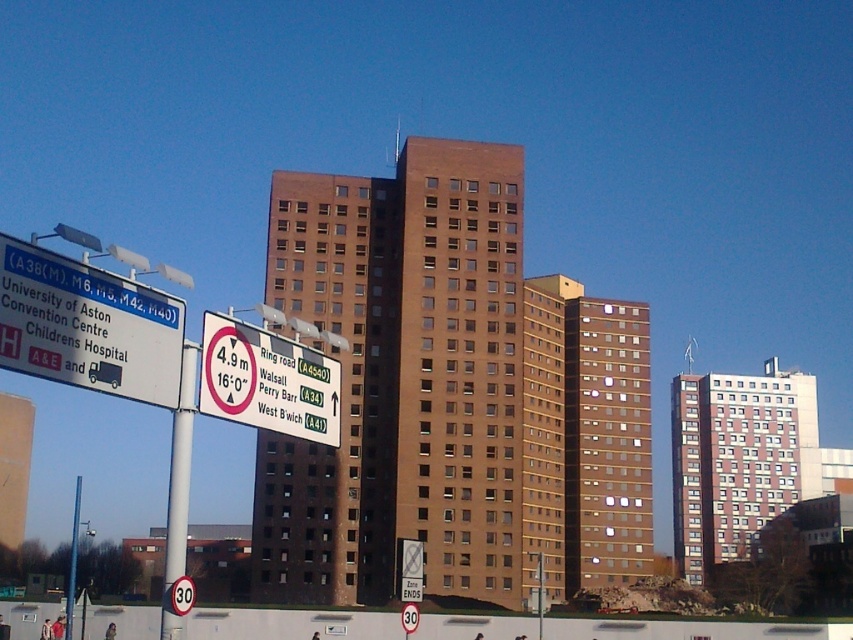
You are driving a truck that is 5 meters tall and approaching the intersection shown in the scene. You see the white plastic sign at upper center and the white plastic pole at left. Which object will you need to avoid due to the height restriction?

The white plastic pole at left has a height restriction of 4.9 meters, so the truck must avoid hitting it as it is taller than the allowed limit.

From the picture: You are a delivery driver approaching the scene and notice the white plastic pole at left and the metallic pole at left. Which pole is located higher up in the image?

The white plastic pole at left is positioned over the metallic pole at left, so it is higher up in the image.

You are driving a truck that is 16.4 feet wide. You need to navigate between the white plastic pole at left and the metallic pole at left. Can your truck fit through the gap between them?

The distance between the white plastic pole at left and metallic pole at left is 196.35 feet, so yes, the truck can fit through the gap since the gap is wider than the truck.